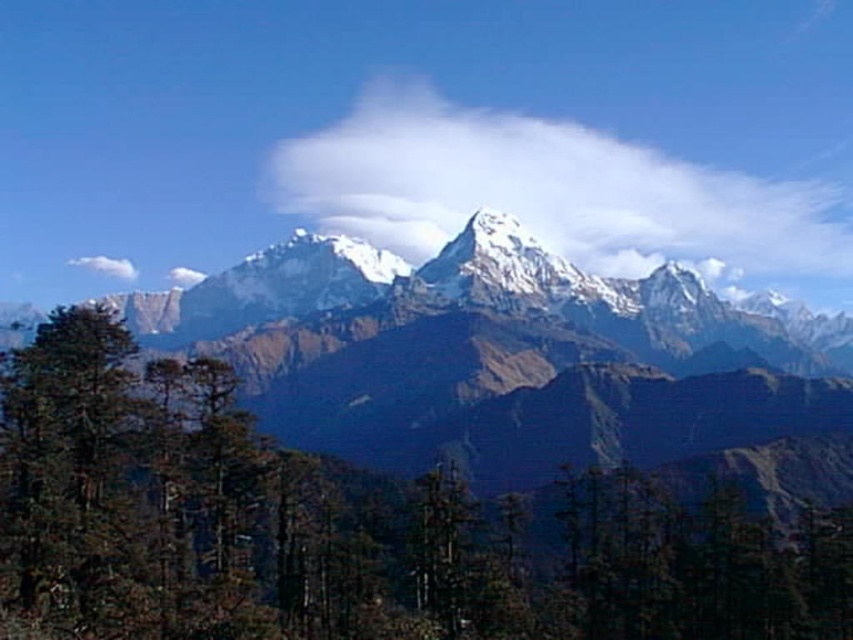
Does green matte tree at center lie in front of white fluffy cloud at upper center?

Yes, it is.

Which is behind, point (566, 534) or point (100, 256)?

The point (100, 256) is behind.

Locate an element on the screen. green matte tree at center is located at coordinates 347,529.

Does green matte tree at center have a larger size compared to white fluffy cloud at center?

No.

Is point (323, 470) farther from camera compared to point (761, 189)?

No, it is in front of (761, 189).

Locate an element on the screen. The height and width of the screenshot is (640, 853). green matte tree at center is located at coordinates coord(347,529).

Is white fluffy cloud at center to the right of white fluffy cloud at upper center from the viewer's perspective?

Yes, white fluffy cloud at center is to the right of white fluffy cloud at upper center.

Which is in front, point (474, 193) or point (100, 262)?

Positioned in front is point (474, 193).

This screenshot has width=853, height=640. What are the coordinates of `white fluffy cloud at center` in the screenshot? It's located at (554, 193).